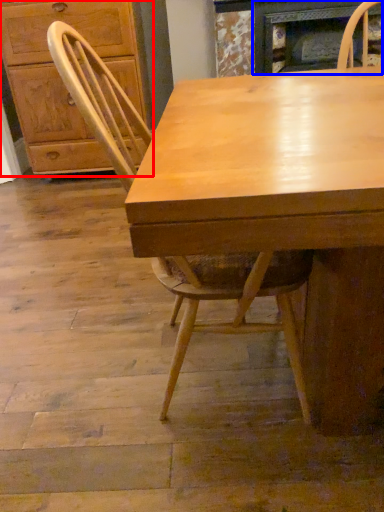
Question: Which object is further to the camera taking this photo, cabinetry (highlighted by a red box) or fireplace (highlighted by a blue box)?

Choices:
 (A) cabinetry
 (B) fireplace

Answer: (A)